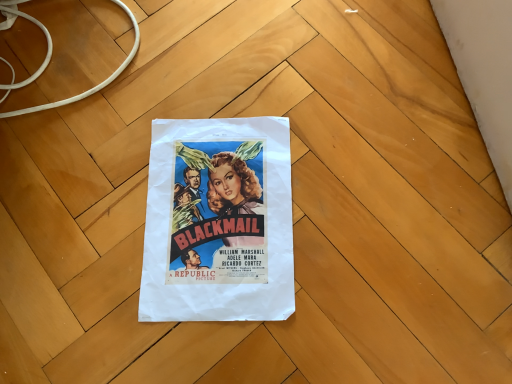
This screenshot has width=512, height=384. I want to click on blank space above white paper poster at center (from a real-world perspective), so click(215, 208).